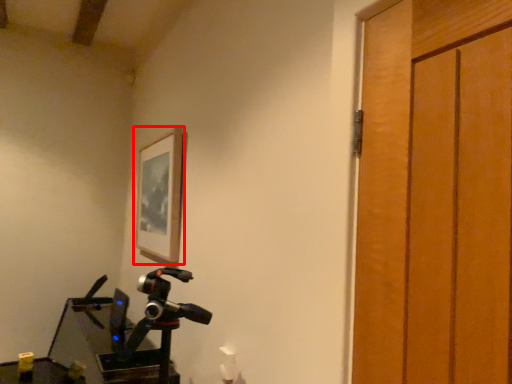
Question: Considering the relative positions of picture frame (annotated by the red box) and workbench in the image provided, where is picture frame (annotated by the red box) located with respect to the staircase?

Choices:
 (A) left
 (B) right

Answer: (B)